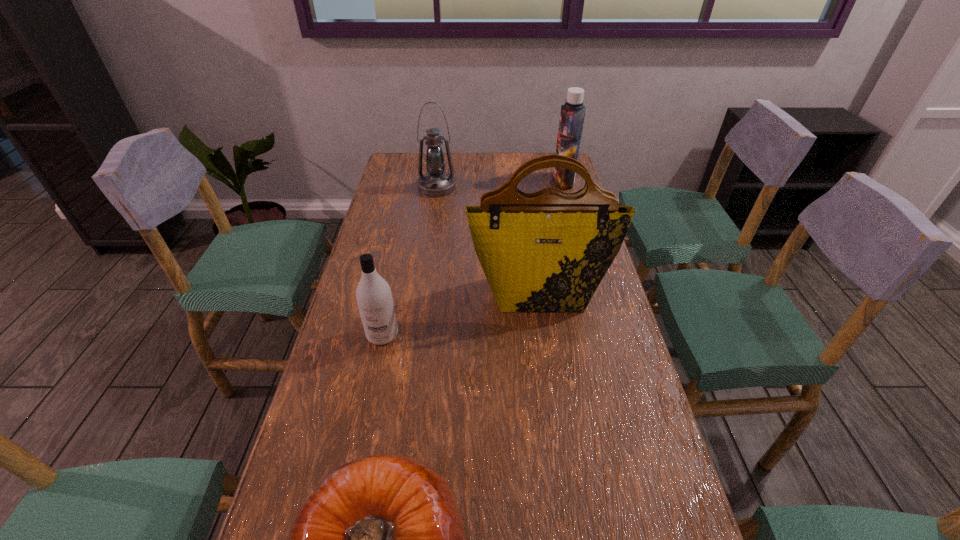
You are a GUI agent. You are given a task and a screenshot of the screen. Output one action in this format:
    pyautogui.click(x=<x>, y=<y>)
    Task: Click on the third nearest object
    Image resolution: width=960 pixels, height=540 pixels.
    Given the screenshot: What is the action you would take?
    pyautogui.click(x=547, y=251)

Identify the location of the tallest object. The image size is (960, 540). (547, 251).

You are a GUI agent. You are given a task and a screenshot of the screen. Output one action in this format:
    pyautogui.click(x=<x>, y=<y>)
    Task: Click on the farther shampoo
    This screenshot has width=960, height=540.
    Given the screenshot: What is the action you would take?
    pyautogui.click(x=572, y=114)

This screenshot has width=960, height=540. I want to click on the taller shampoo, so pyautogui.click(x=572, y=114).

The height and width of the screenshot is (540, 960). In order to click on oil lamp in this screenshot , I will do `click(436, 183)`.

Locate an element on the screen. The width and height of the screenshot is (960, 540). the left shampoo is located at coordinates (x=374, y=298).

Where is `the fourth tallest object`? The height and width of the screenshot is (540, 960). the fourth tallest object is located at coordinates (374, 298).

Identify the location of blank space located on the front-facing side of the third nearest object. (557, 408).

The height and width of the screenshot is (540, 960). Identify the location of free region located on the front label of the right shampoo. (537, 181).

Where is `blank space located 0.390m on the front label of the right shampoo`? Image resolution: width=960 pixels, height=540 pixels. blank space located 0.390m on the front label of the right shampoo is located at coordinates (451, 181).